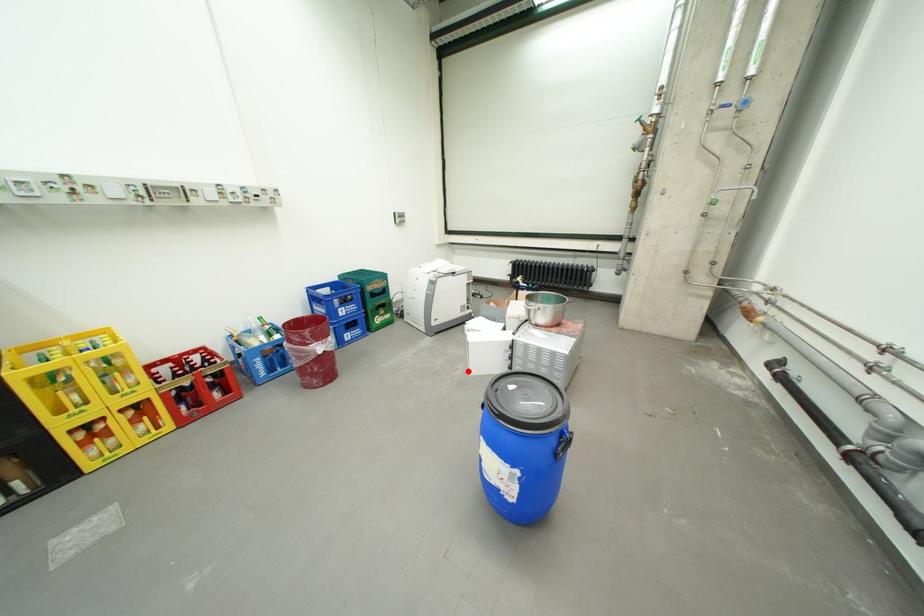
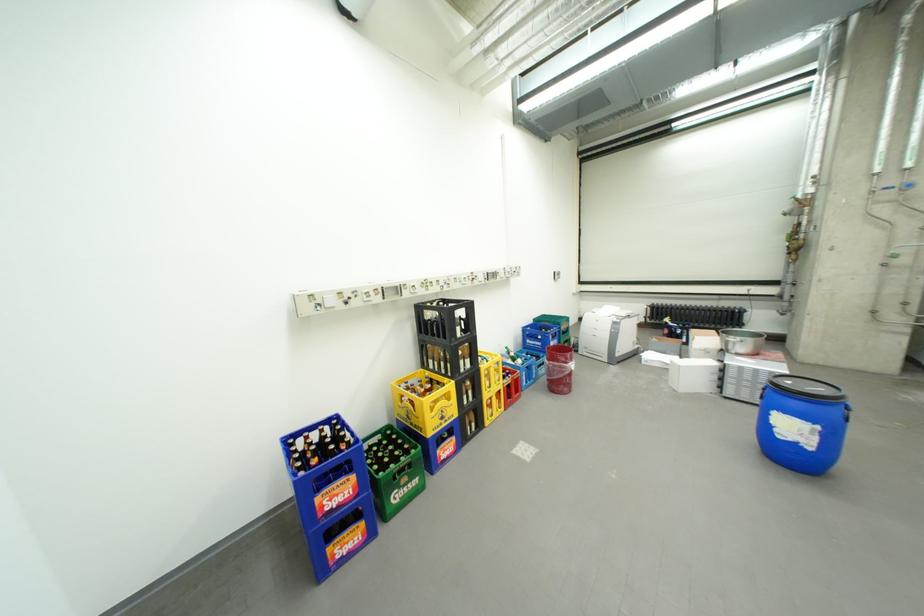
In the second image, find the point that corresponds to the highlighted location in the first image.

(674, 390)